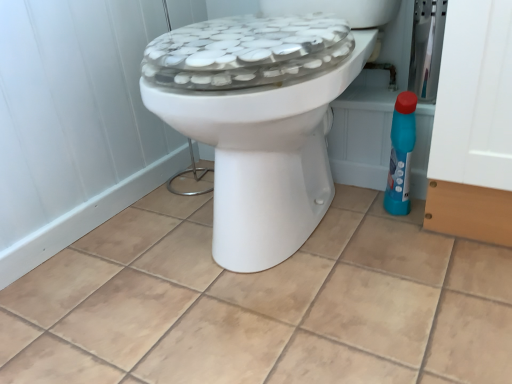
Question: Is the position of white glossy toilet at center more distant than that of blue plastic bottle at right?

Choices:
 (A) no
 (B) yes

Answer: (A)

Question: Can you confirm if white glossy toilet at center is positioned to the left of blue plastic bottle at right?

Choices:
 (A) no
 (B) yes

Answer: (B)

Question: Is white glossy toilet at center at the right side of blue plastic bottle at right?

Choices:
 (A) no
 (B) yes

Answer: (A)

Question: From the image's perspective, is white glossy toilet at center on blue plastic bottle at right?

Choices:
 (A) yes
 (B) no

Answer: (A)

Question: Is white glossy toilet at center wider than blue plastic bottle at right?

Choices:
 (A) yes
 (B) no

Answer: (A)

Question: Can we say white glossy toilet at center lies outside blue plastic bottle at right?

Choices:
 (A) no
 (B) yes

Answer: (B)

Question: From the image's perspective, is beige ceramic tile at center beneath blue plastic bottle at right?

Choices:
 (A) no
 (B) yes

Answer: (B)

Question: From a real-world perspective, is beige ceramic tile at center located beneath blue plastic bottle at right?

Choices:
 (A) no
 (B) yes

Answer: (B)

Question: Is beige ceramic tile at center located outside blue plastic bottle at right?

Choices:
 (A) yes
 (B) no

Answer: (A)

Question: Does beige ceramic tile at center have a lesser height compared to blue plastic bottle at right?

Choices:
 (A) yes
 (B) no

Answer: (A)

Question: From a real-world perspective, does beige ceramic tile at center stand above blue plastic bottle at right?

Choices:
 (A) no
 (B) yes

Answer: (A)

Question: Is the surface of beige ceramic tile at center in direct contact with blue plastic bottle at right?

Choices:
 (A) no
 (B) yes

Answer: (A)

Question: From a real-world perspective, is blue plastic bottle at right positioned under white glossy toilet at center based on gravity?

Choices:
 (A) yes
 (B) no

Answer: (A)